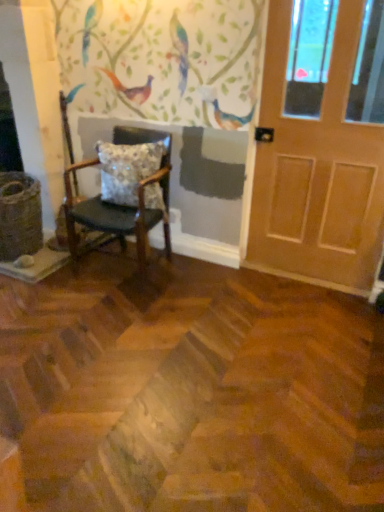
Question: Is wooden chair with cushion at left directly adjacent to light brown wooden door at right?

Choices:
 (A) yes
 (B) no

Answer: (B)

Question: Is wooden chair with cushion at left closer to camera compared to light brown wooden door at right?

Choices:
 (A) yes
 (B) no

Answer: (B)

Question: Can you confirm if wooden chair with cushion at left is taller than light brown wooden door at right?

Choices:
 (A) no
 (B) yes

Answer: (A)

Question: From a real-world perspective, is wooden chair with cushion at left located beneath light brown wooden door at right?

Choices:
 (A) no
 (B) yes

Answer: (B)

Question: Is wooden chair with cushion at left further to camera compared to light brown wooden door at right?

Choices:
 (A) yes
 (B) no

Answer: (A)

Question: Can you confirm if wooden chair with cushion at left is shorter than light brown wooden door at right?

Choices:
 (A) yes
 (B) no

Answer: (A)

Question: Is wooden chair with cushion at left completely or partially inside light brown wooden door at right?

Choices:
 (A) yes
 (B) no

Answer: (B)

Question: Does light brown wooden door at right come in front of wooden chair with cushion at left?

Choices:
 (A) yes
 (B) no

Answer: (A)

Question: Can you confirm if light brown wooden door at right is thinner than wooden chair with cushion at left?

Choices:
 (A) no
 (B) yes

Answer: (B)

Question: From the image's perspective, would you say light brown wooden door at right is shown under wooden chair with cushion at left?

Choices:
 (A) yes
 (B) no

Answer: (B)

Question: Considering the relative positions of light brown wooden door at right and wooden chair with cushion at left in the image provided, is light brown wooden door at right to the right of wooden chair with cushion at left from the viewer's perspective?

Choices:
 (A) yes
 (B) no

Answer: (A)

Question: Considering the relative sizes of light brown wooden door at right and wooden chair with cushion at left in the image provided, is light brown wooden door at right taller than wooden chair with cushion at left?

Choices:
 (A) yes
 (B) no

Answer: (A)

Question: Is floral-patterned fabric pillow at center inside wooden chair with cushion at left?

Choices:
 (A) yes
 (B) no

Answer: (A)